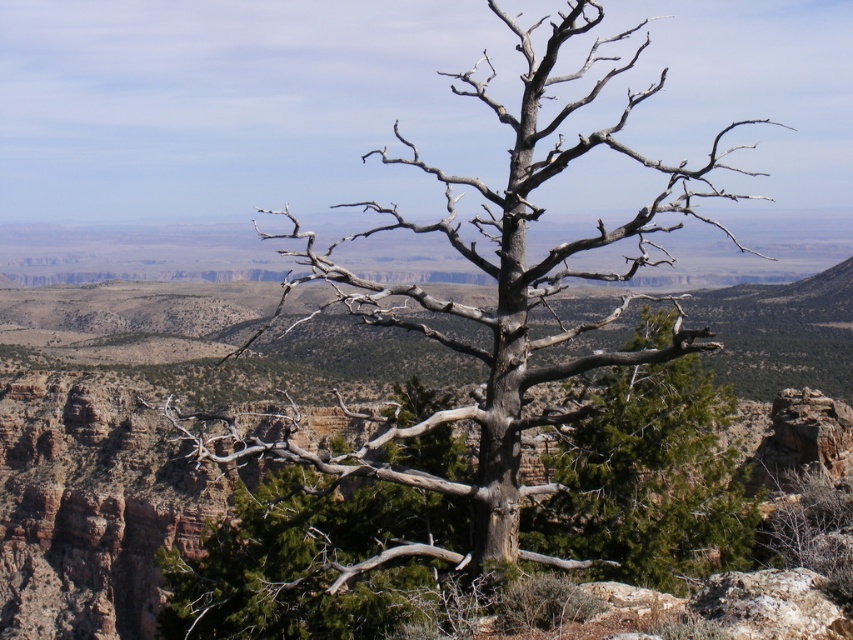
You are standing at the base of the barren tree in the foreground. Looking towards the center of the image, you see a point marked at coordinates (144, 432). What does this point represent in the landscape?

The point at coordinates (144, 432) corresponds to the brown rocky canyon at center.

Looking at this image, you are a hiker standing at the base of the barren tree in the foreground. You spot the brown rocky canyon at center in the distance. If your GPS says you need to reach the canyon within 10 minutes, and you walk at a brisk pace of 5 meters per minute, will you be able to reach it on time?

The distance between you and the brown rocky canyon at center is 45.73 meters. At a walking speed of 5 meters per minute, it would take 9.15 minutes to reach it. Since this is under 10 minutes, you will arrive on time.